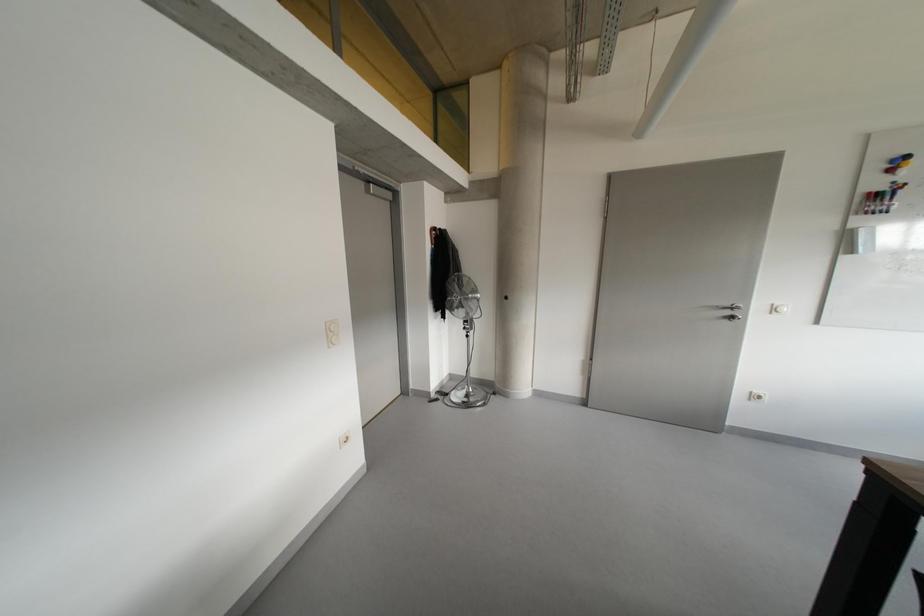
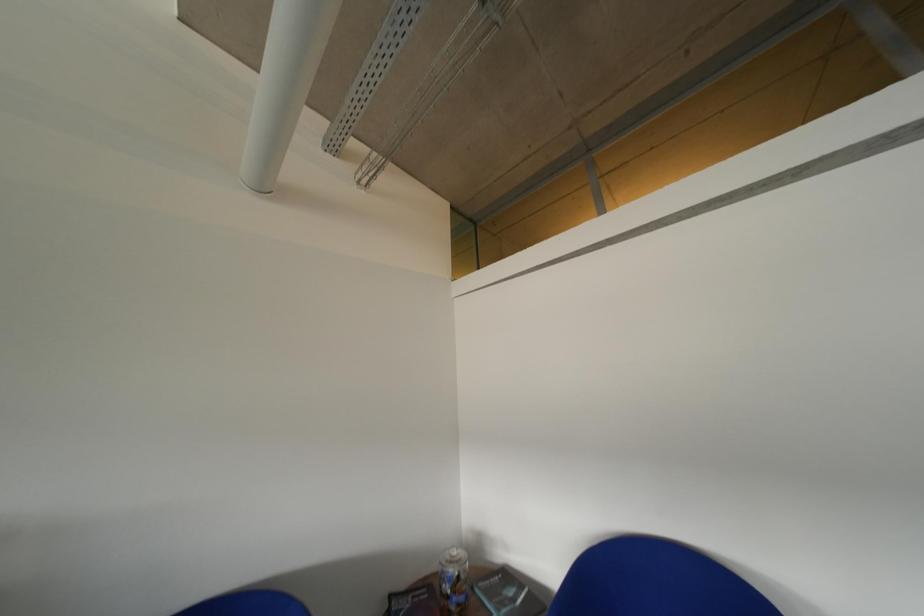
Question: The first image is from the beginning of the video and the second image is from the end. How did the camera likely rotate when shooting the video?

Choices:
 (A) Left
 (B) Right
 (C) Up
 (D) Down

Answer: (A)